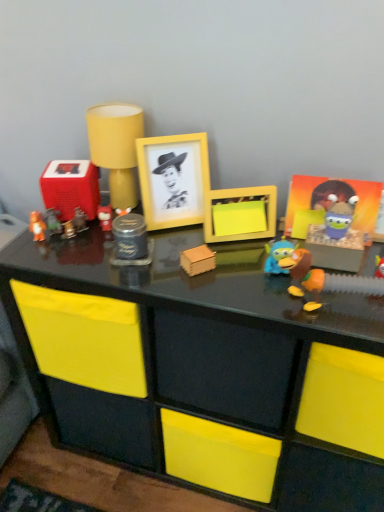
Identify the location of free space that is in between blue rubber duck at center, which is counted as the eleventh toy, starting from the left, and wooden block at center, positioned as the ninth toy in left-to-right order. (246, 278).